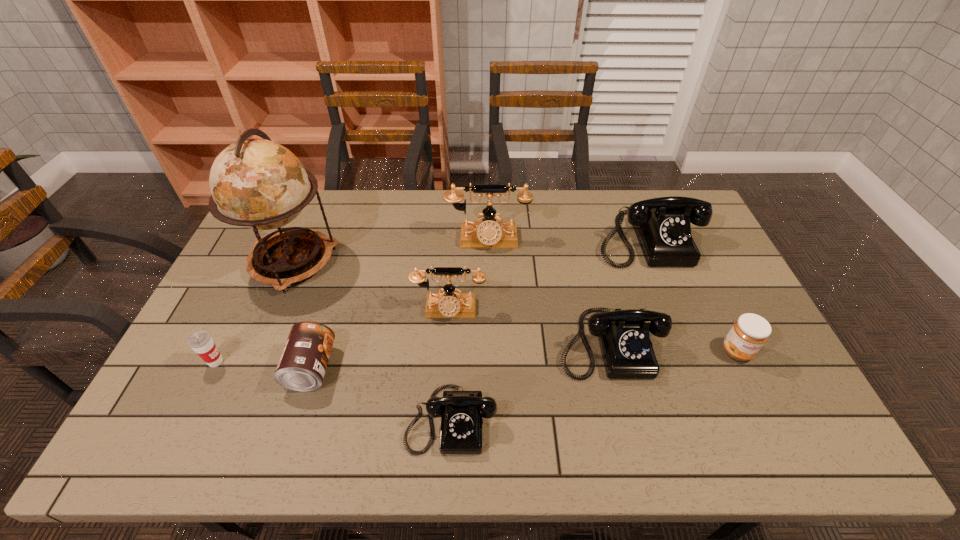
At what (x,y) coordinates should I click in order to perform the action: click on blank space that satisfies the following two spatial constraints: 1. on the dial of the second shortest telephone; 2. on the side of the red cup with the logo. Please return your answer as a coordinate pair (x, y). The height and width of the screenshot is (540, 960). Looking at the image, I should click on (613, 362).

Where is `vacant space that satisfies the following two spatial constraints: 1. on the dial of the tallest telephone; 2. on the front label of the can`? vacant space that satisfies the following two spatial constraints: 1. on the dial of the tallest telephone; 2. on the front label of the can is located at coordinates (490, 368).